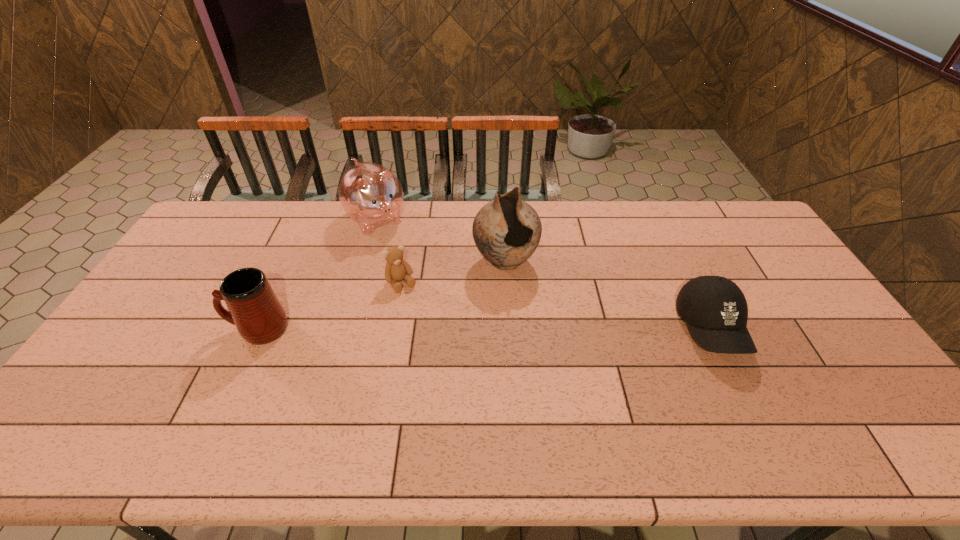
This screenshot has height=540, width=960. In order to click on vacant space situated from the spout of the second object from right to left in this screenshot , I will do `click(521, 294)`.

Identify the location of object at the far edge. (371, 195).

You are a GUI agent. You are given a task and a screenshot of the screen. Output one action in this format:
    pyautogui.click(x=<x>, y=<y>)
    Task: Click on the vacant area at the far edge of the desktop
    The width and height of the screenshot is (960, 540).
    Given the screenshot: What is the action you would take?
    pyautogui.click(x=465, y=221)

Find the location of a particular element. The image size is (960, 540). vacant region at the near edge of the desktop is located at coordinates (554, 383).

Locate an element on the screen. This screenshot has width=960, height=540. vacant space at the right edge of the desktop is located at coordinates (784, 334).

Locate an element on the screen. The image size is (960, 540). free space at the near left corner is located at coordinates (85, 404).

Locate an element on the screen. The image size is (960, 540). empty location between the rightmost object and the mug is located at coordinates (485, 329).

The width and height of the screenshot is (960, 540). What are the coordinates of `empty space that is in between the teddy bear and the third shortest object` in the screenshot? It's located at (330, 306).

Where is `empty location between the farthest object and the second object from right to left`? The image size is (960, 540). empty location between the farthest object and the second object from right to left is located at coordinates (441, 240).

Identify the location of empty location between the fourth shortest object and the pottery. (441, 240).